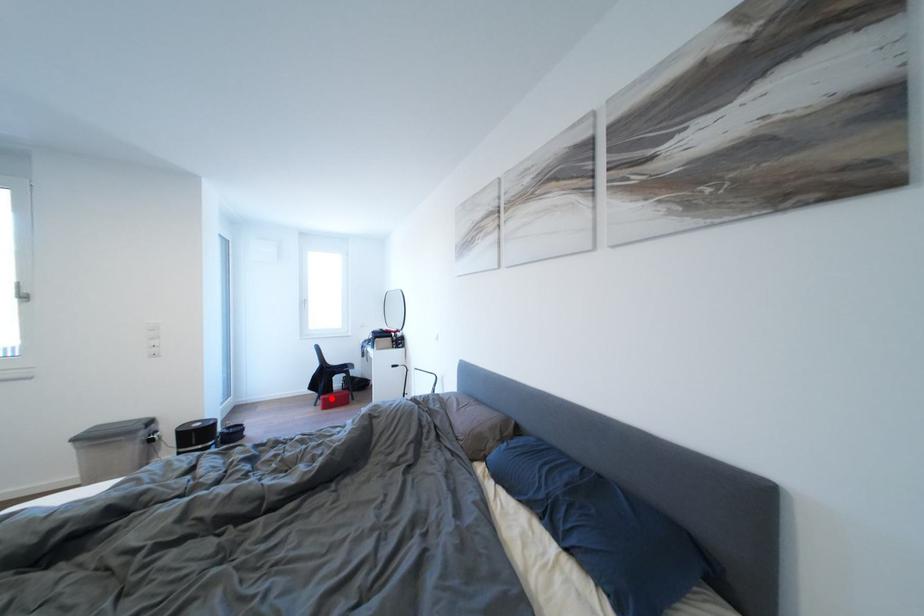
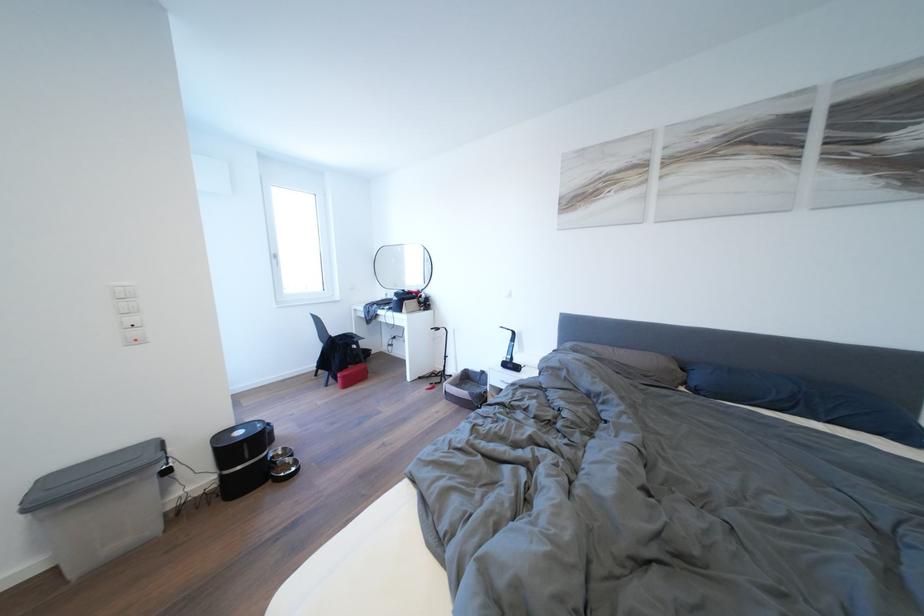
Question: I am providing you with two images of the same scene from different viewpoints. A red point is shown in image1. For the corresponding object point in image2, is it positioned nearer or farther from the camera?

Choices:
 (A) Nearer
 (B) Farther

Answer: (A)